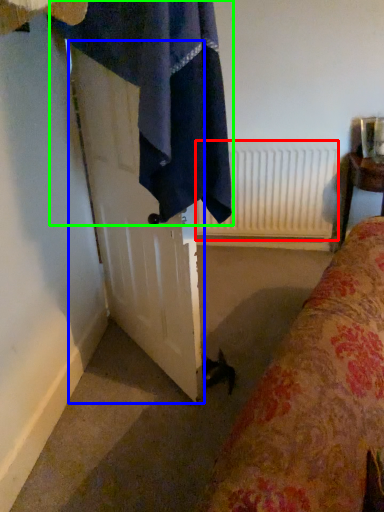
Question: Which is nearer to the radiator (highlighted by a red box)? screen door (highlighted by a blue box) or bath towel (highlighted by a green box).

Choices:
 (A) screen door
 (B) bath towel

Answer: (A)